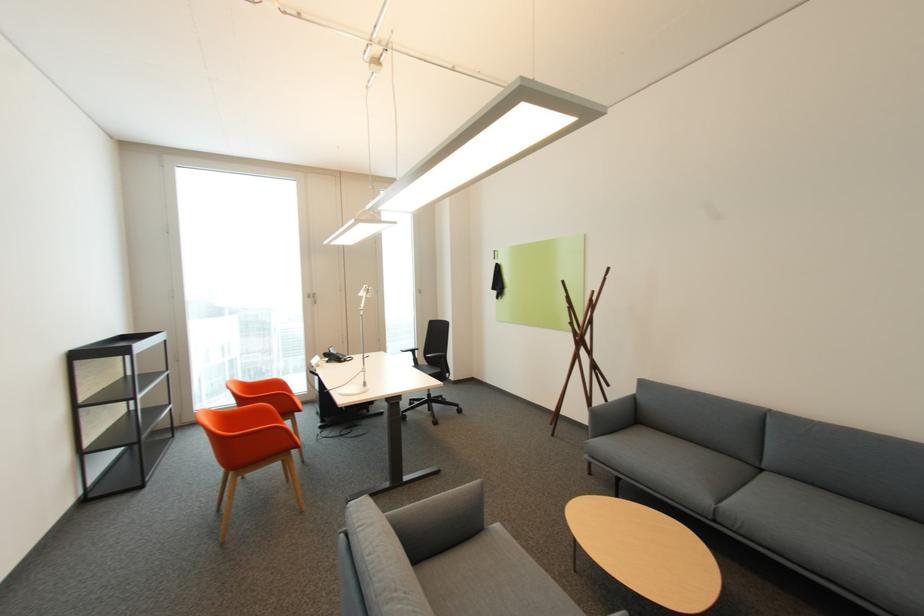
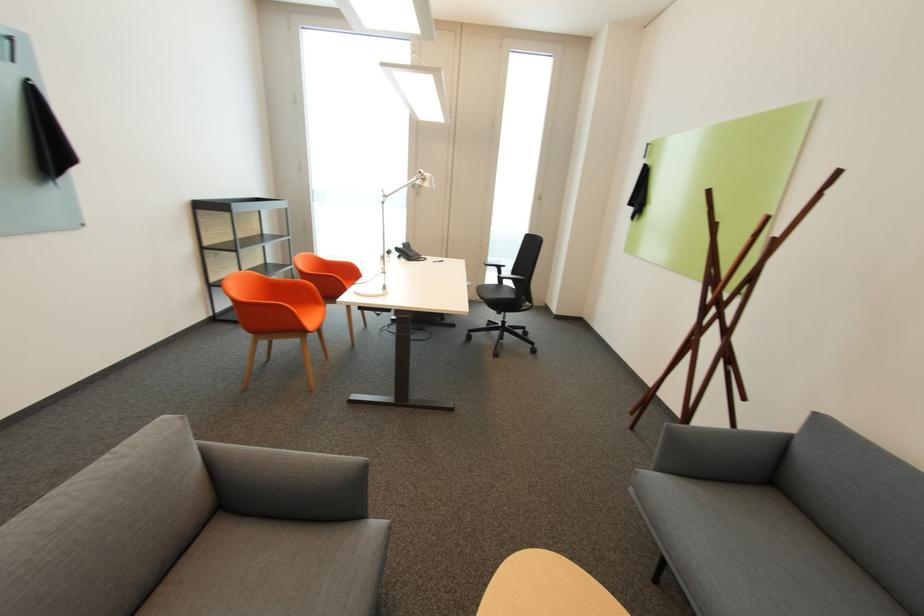
Where in the second image is the point corresponding to the point at 348,360 from the first image?

(419, 259)